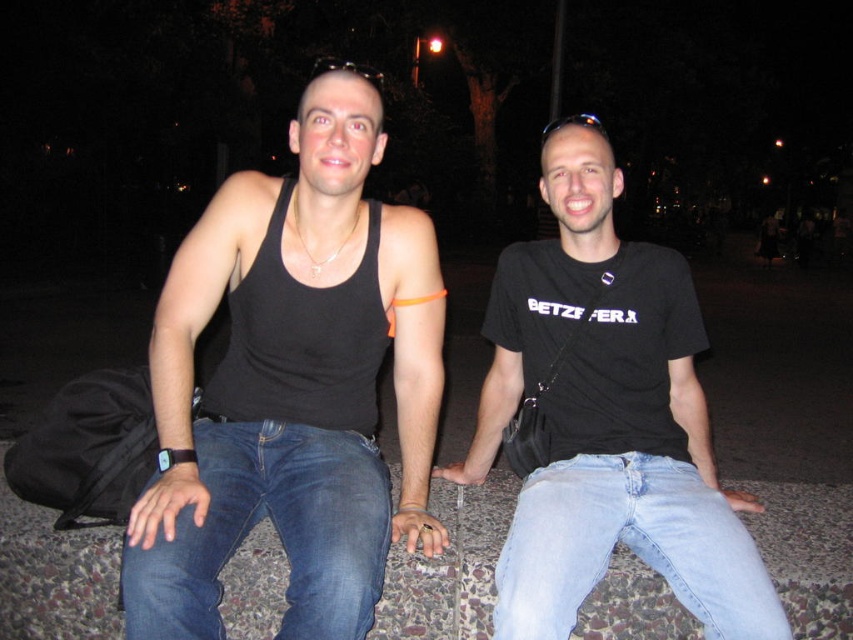
Between black matte tank top at left and black cotton t-shirt at center, which one appears on the left side from the viewer's perspective?

Positioned to the left is black matte tank top at left.

Between point (195, 292) and point (595, 188), which one is positioned behind?

Positioned behind is point (595, 188).

Find the location of a particular element. This screenshot has width=853, height=640. black matte tank top at left is located at coordinates (292, 385).

Describe the element at coordinates (276, 529) in the screenshot. This screenshot has width=853, height=640. I see `denim jeans at lower left` at that location.

At what (x,y) coordinates should I click in order to perform the action: click on denim jeans at lower left. Please return your answer as a coordinate pair (x, y). Looking at the image, I should click on (276, 529).

Is point (196, 602) closer to viewer compared to point (556, 547)?

Yes, point (196, 602) is closer to viewer.

Find the location of a particular element. The width and height of the screenshot is (853, 640). denim jeans at lower left is located at coordinates (276, 529).

Is black matte tank top at left further to the viewer compared to denim jeans at lower left?

Yes, black matte tank top at left is further from the viewer.

Is point (161, 387) positioned before point (318, 560)?

That is False.

The width and height of the screenshot is (853, 640). I want to click on black matte tank top at left, so click(x=292, y=385).